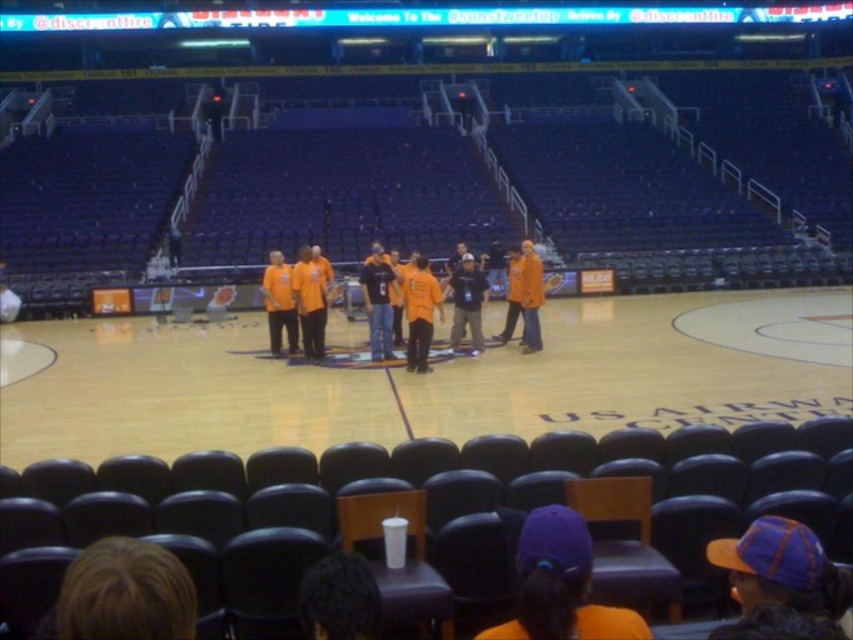
Does orange cotton shirts at center have a smaller size compared to orange jersey at center?

No, orange cotton shirts at center is not smaller than orange jersey at center.

Is orange cotton shirts at center behind orange jersey at center?

Yes.

Which is in front, point (375, 352) or point (421, 324)?

Point (421, 324)

Where is `orange cotton shirts at center`? The image size is (853, 640). orange cotton shirts at center is located at coordinates (383, 305).

Does wooden basketball court at center appear on the right side of orange cotton shirt at center?

Correct, you'll find wooden basketball court at center to the right of orange cotton shirt at center.

Is wooden basketball court at center further to camera compared to orange cotton shirt at center?

No, it is not.

Between point (155, 368) and point (288, 275), which one is positioned in front?

Point (155, 368) is in front.

At what (x,y) coordinates should I click in order to perform the action: click on wooden basketball court at center. Please return your answer as a coordinate pair (x, y). The height and width of the screenshot is (640, 853). Looking at the image, I should click on pos(432,380).

What do you see at coordinates (421, 310) in the screenshot? Image resolution: width=853 pixels, height=640 pixels. I see `orange jersey at center` at bounding box center [421, 310].

Who is more distant from viewer, (425, 324) or (277, 301)?

The point (277, 301) is behind.

Find the location of a particular element. orange jersey at center is located at coordinates (421, 310).